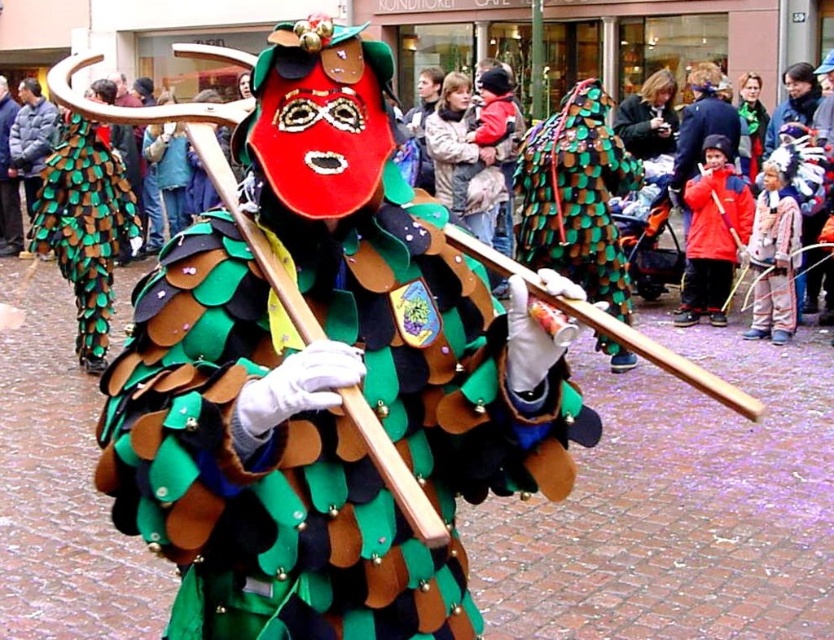
You are a photographer trying to capture the mythical creature costume in the scene. The green felt costume at center and the matte red mask at center are both important elements. Which object should you focus on first to ensure it appears larger in your photo?

The green felt costume at center is closer to the viewer than the matte red mask at center, so focusing on it first will make it appear larger in the photo.

You are standing at the edge of the street and see both the green textured scales at center and the green felt scales at center. Which one is closer to you?

The green textured scales at center is 3.31 meters away from the green felt scales at center, so the green textured scales at center is closer to you.

You are a photographer trying to capture the mythical creature in the center of the scene. The creature is positioned at coordinates 0.308 on the horizontal axis and 0.691 on the vertical axis. If your camera has a zoom lens that can focus precisely on objects at specific coordinates, what coordinates should you set to ensure the green textured scales at center are in the frame?

The green textured scales at center are located at coordinates 0.308 on the horizontal axis and 0.691 on the vertical axis, so setting the camera to focus at those coordinates will ensure they are in the frame.